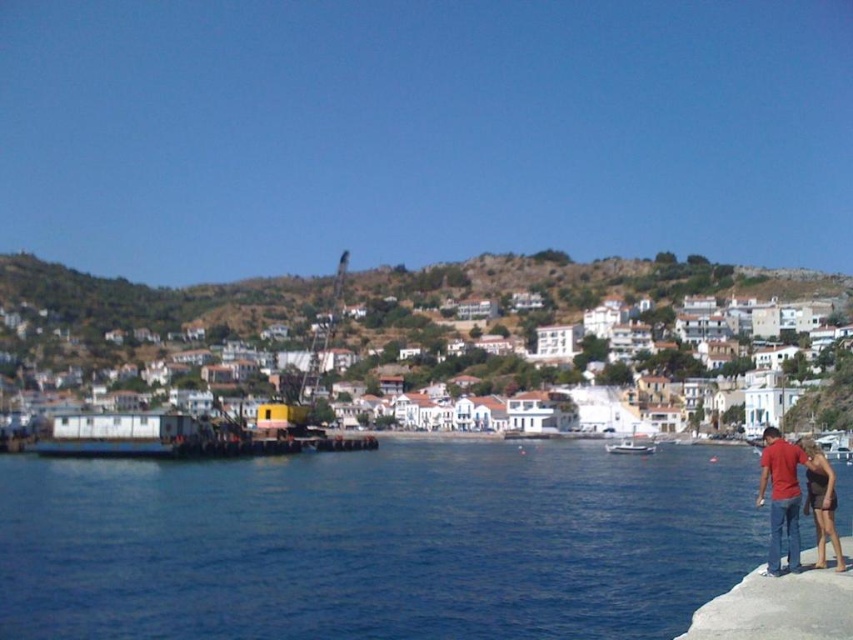
Can you confirm if blue water at lower left is positioned to the left of dark brown fabric dress at lower right?

Correct, you'll find blue water at lower left to the left of dark brown fabric dress at lower right.

At what (x,y) coordinates should I click in order to perform the action: click on blue water at lower left. Please return your answer as a coordinate pair (x, y). Image resolution: width=853 pixels, height=640 pixels. Looking at the image, I should click on (376, 544).

Between point (56, 467) and point (624, 445), which one is positioned in front?

Positioned in front is point (56, 467).

Can you confirm if blue water at lower left is positioned above white matte boat at center?

Correct, blue water at lower left is located above white matte boat at center.

Where is `blue water at lower left`? blue water at lower left is located at coordinates (376, 544).

Which is more to the left, blue water at lower left or white matte buildings at center?

From the viewer's perspective, white matte buildings at center appears more on the left side.

Is point (268, 550) farther from viewer compared to point (135, 314)?

No, (268, 550) is in front of (135, 314).

Is point (753, 518) closer to camera compared to point (16, 301)?

Yes, it is.

I want to click on blue water at lower left, so click(x=376, y=544).